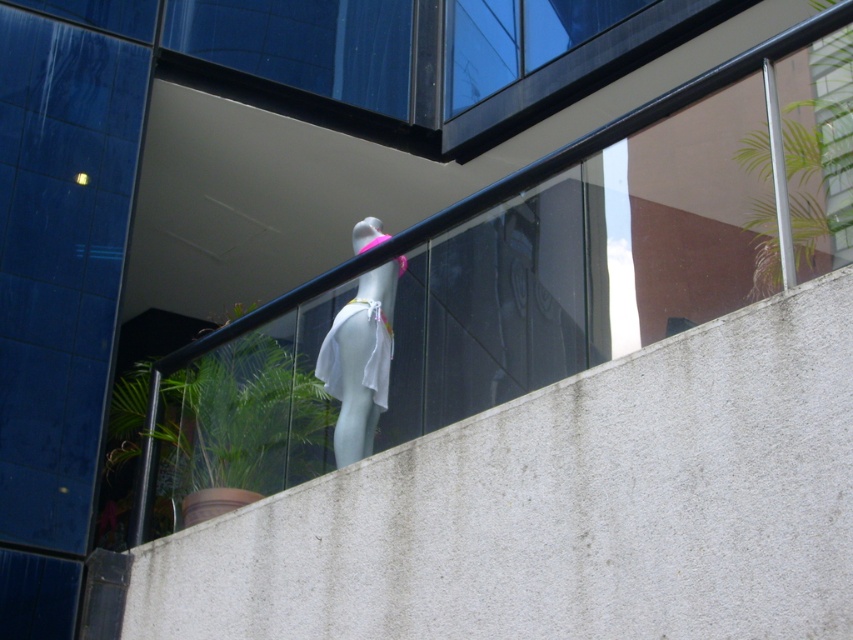
Is white concrete ledge at center shorter than white matte mannequin at center?

In fact, white concrete ledge at center may be taller than white matte mannequin at center.

Where is `white concrete ledge at center`? white concrete ledge at center is located at coordinates [566, 508].